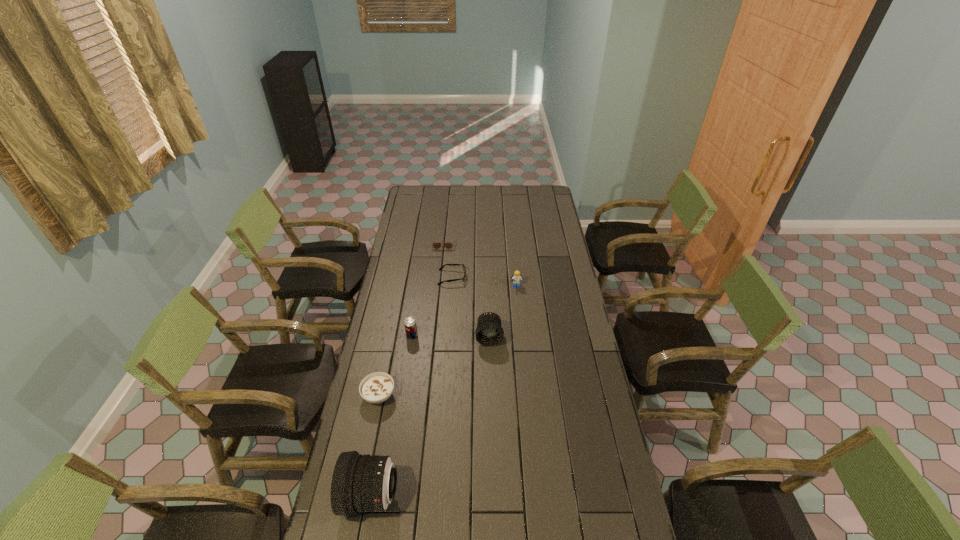
The width and height of the screenshot is (960, 540). I want to click on the taller telephoto lens, so click(x=361, y=483).

This screenshot has height=540, width=960. Identify the location of the nearer telephoto lens. (361, 483).

Where is `the second tallest object`? This screenshot has height=540, width=960. the second tallest object is located at coordinates (489, 332).

Image resolution: width=960 pixels, height=540 pixels. Find the location of `the right telephoto lens`. the right telephoto lens is located at coordinates (489, 332).

Identify the location of spectacles. (441, 268).

Where is `beer can`? Image resolution: width=960 pixels, height=540 pixels. beer can is located at coordinates (410, 325).

Locate an element on the screen. The width and height of the screenshot is (960, 540). Lego is located at coordinates (516, 278).

Where is `the farthest object`? The width and height of the screenshot is (960, 540). the farthest object is located at coordinates (436, 245).

Where is `soup bowl`? soup bowl is located at coordinates (375, 388).

The image size is (960, 540). I want to click on the fifth tallest object, so click(x=375, y=388).